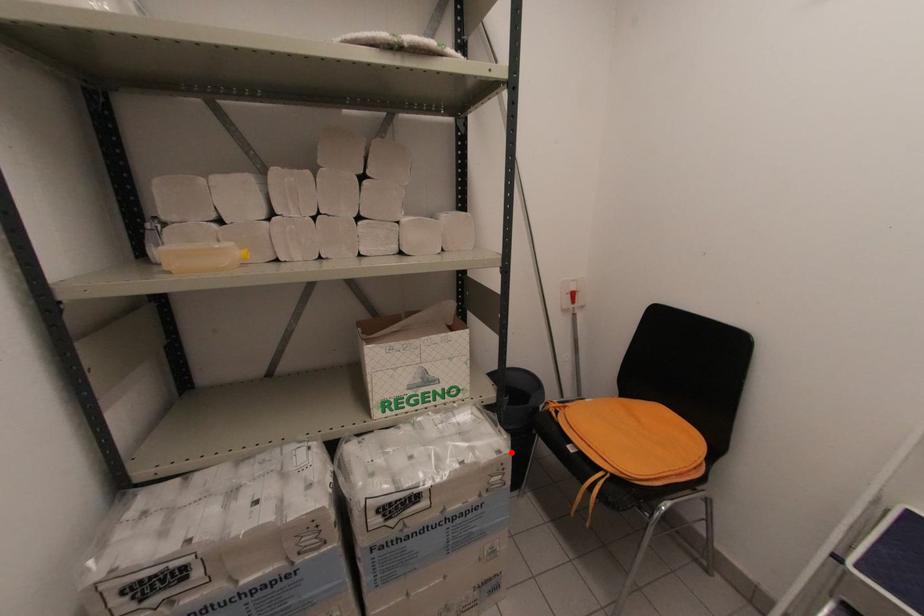
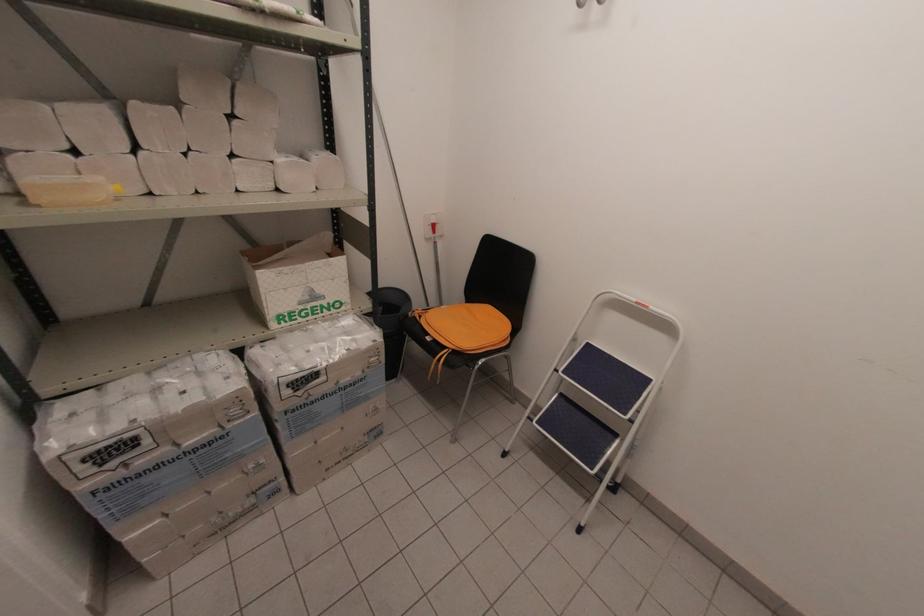
Question: I am providing you with two images of the same scene from different viewpoints. Given a red point in image1, look at the same physical point in image2. Is it:

Choices:
 (A) Closer to the viewpoint
 (B) Farther from the viewpoint

Answer: (A)